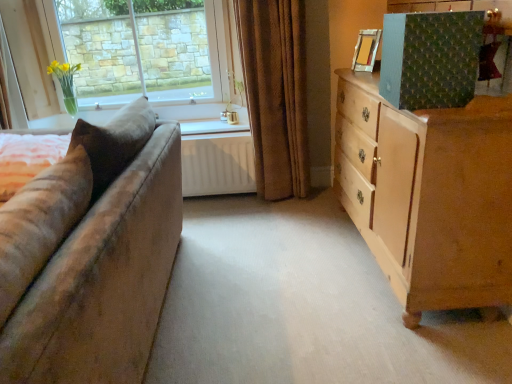
Find the location of a particular element. free space in front of brown velvet curtain at center is located at coordinates click(x=279, y=219).